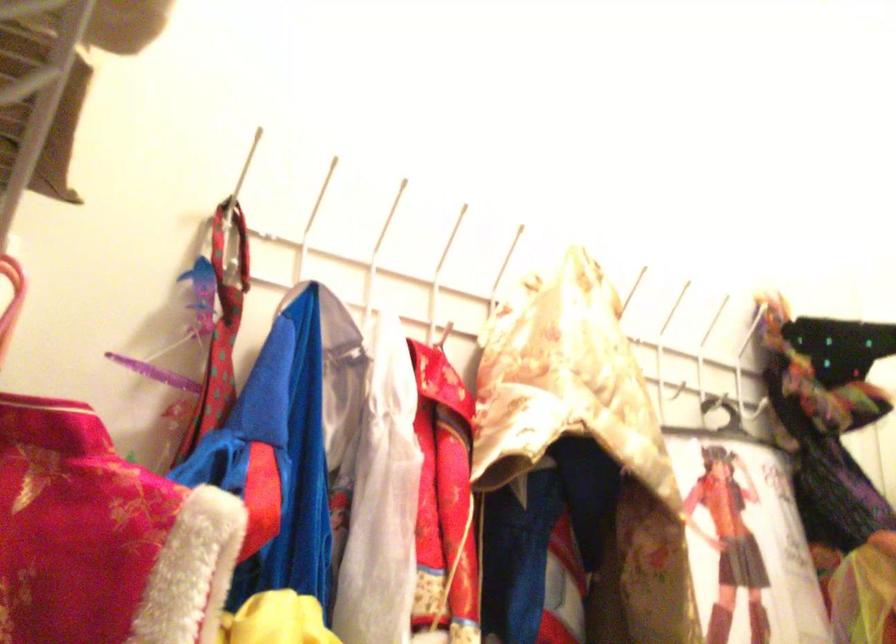
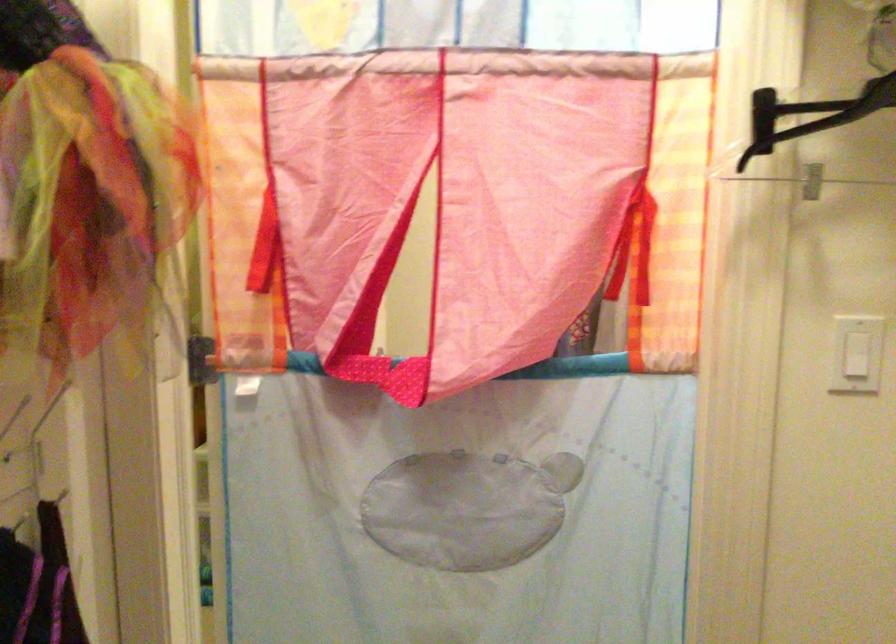
How did the camera likely rotate?

The camera's rotation is toward right-down.